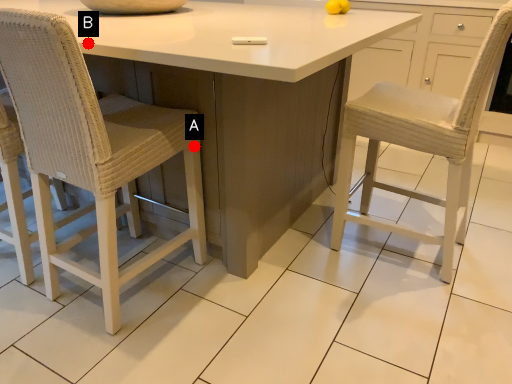
Question: Two points are circled on the image, labeled by A and B beside each circle. Which point is farther from the camera taking this photo?

Choices:
 (A) A is further
 (B) B is further

Answer: (A)